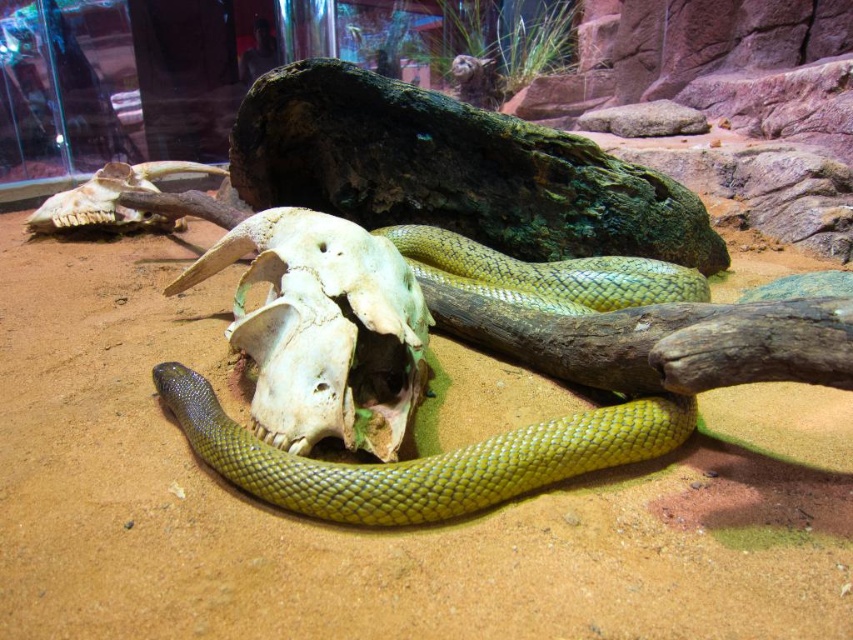
Question: Can you confirm if green glossy snake at center is positioned above white bone skull at center?

Choices:
 (A) yes
 (B) no

Answer: (A)

Question: Can you confirm if green glossy snake at center is positioned above white bone skull at center?

Choices:
 (A) no
 (B) yes

Answer: (B)

Question: Which point appears farthest from the camera in this image?

Choices:
 (A) (321, 502)
 (B) (379, 392)

Answer: (B)

Question: Does green glossy snake at center have a lesser width compared to white bone skull at center?

Choices:
 (A) no
 (B) yes

Answer: (A)

Question: Among these objects, which one is nearest to the camera?

Choices:
 (A) green glossy snake at center
 (B) white bone skull at center

Answer: (B)

Question: Which of the following is the closest to the observer?

Choices:
 (A) tap(335, 230)
 (B) tap(520, 296)

Answer: (A)